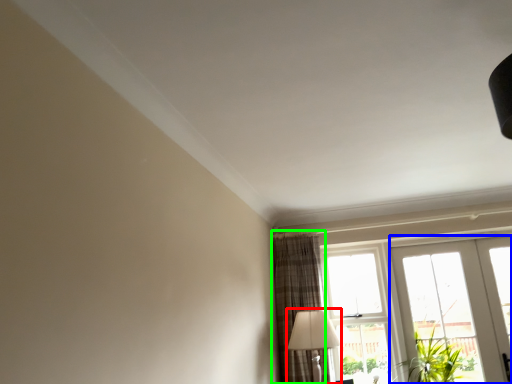
Question: Based on their relative distances, which object is nearer to table lamp (highlighted by a red box)? Choose from door (highlighted by a blue box) and curtain (highlighted by a green box).

Choices:
 (A) door
 (B) curtain

Answer: (B)